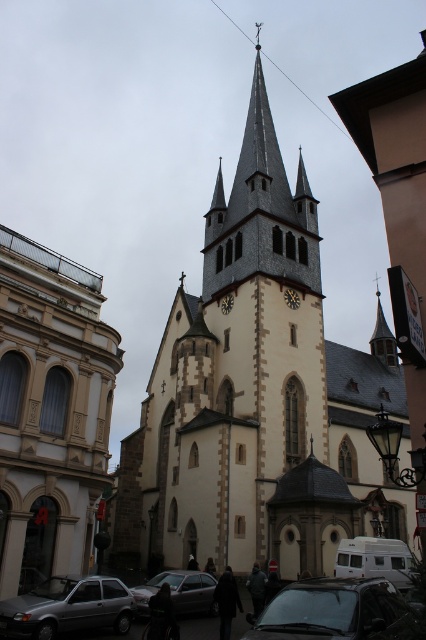
Question: In this image, where is beige stone church at center located relative to wooden clock at center?

Choices:
 (A) left
 (B) right

Answer: (A)

Question: Is beige stone church at center further to camera compared to white matte van at lower center?

Choices:
 (A) yes
 (B) no

Answer: (B)

Question: Considering the real-world distances, which object is closest to the silver metallic sedan at lower center?

Choices:
 (A) wooden clock at center
 (B) matte silver car at lower left
 (C) black glass car at lower center
 (D) beige stone church at center

Answer: (B)

Question: Can you confirm if black glass car at lower center is smaller than white matte van at lower center?

Choices:
 (A) yes
 (B) no

Answer: (B)

Question: Which point is farther to the camera?

Choices:
 (A) white matte van at lower center
 (B) black glass car at lower center
 (C) beige stone church at center
 (D) matte silver car at lower left

Answer: (A)

Question: Which object is closer to the camera taking this photo?

Choices:
 (A) black glass car at lower center
 (B) wooden clock at center
 (C) beige stone church at center
 (D) silver metallic sedan at lower center

Answer: (A)